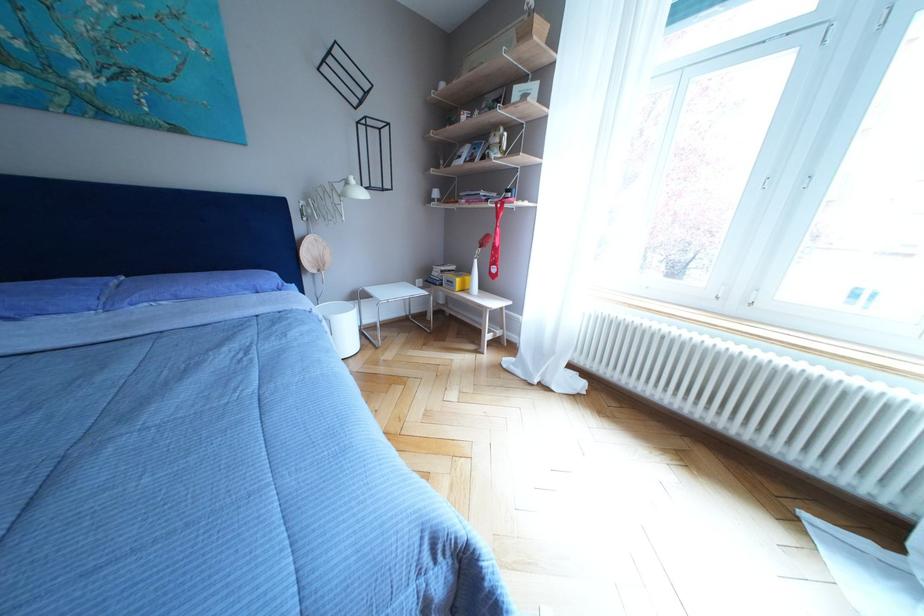
The location [129,292] corresponds to which object?

This point indicates the blue pillow.